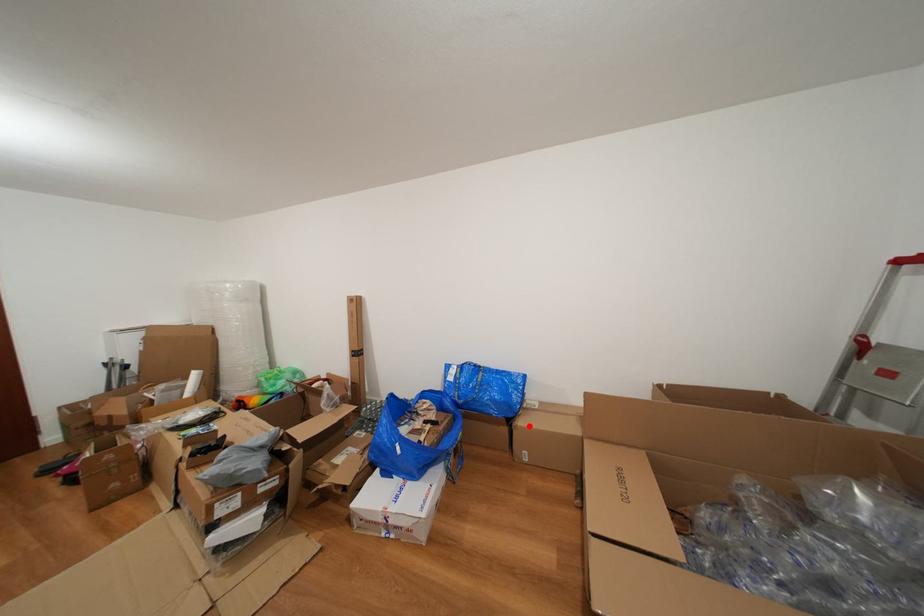
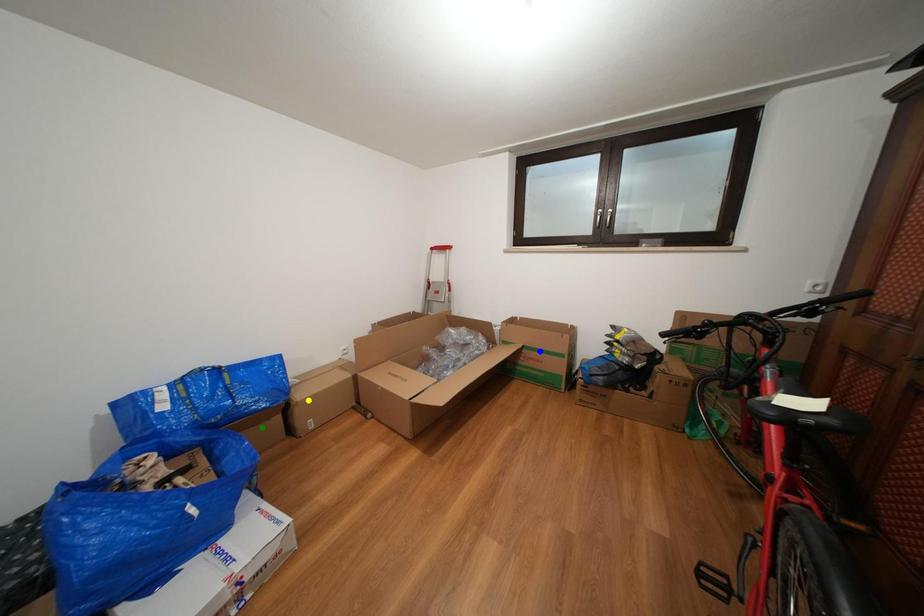
Question: I am providing you with two images of the same scene from different viewpoints. A red point is marked on the first image. You are given multiple points on the second image. Which point in image 2 represents the same 3d spot as the red point in image 1?

Choices:
 (A) yellow point
 (B) green point
 (C) blue point

Answer: (A)